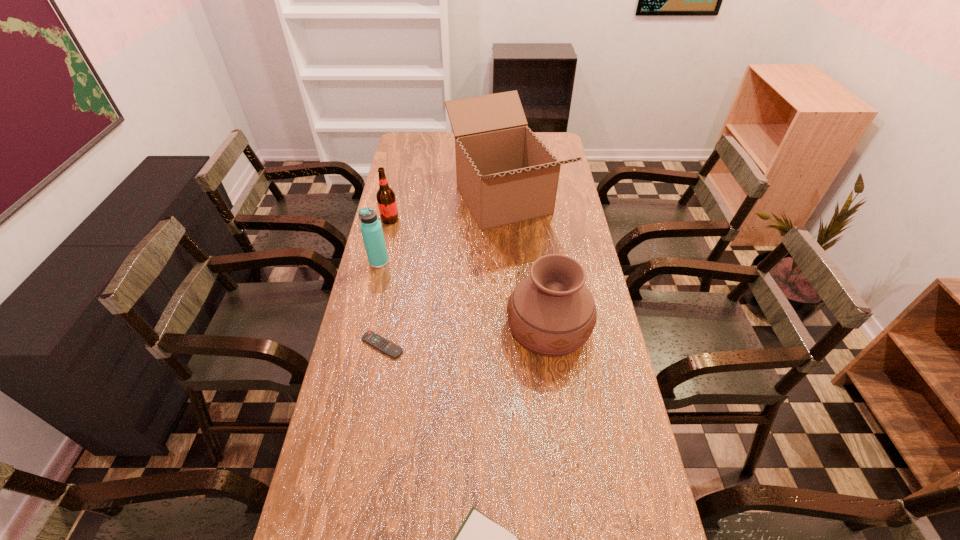
This screenshot has width=960, height=540. I want to click on object that is at the far edge, so click(505, 174).

This screenshot has height=540, width=960. Find the location of `thermos bottle present at the left edge`. thermos bottle present at the left edge is located at coordinates (371, 228).

The height and width of the screenshot is (540, 960). Identify the location of root beer located in the left edge section of the desktop. (386, 200).

The height and width of the screenshot is (540, 960). Identify the location of remote control present at the left edge. 387,347.

Identify the location of box situated at the right edge. (505, 174).

Where is `urn located at the right edge`? urn located at the right edge is located at coordinates (551, 312).

This screenshot has height=540, width=960. In order to click on object at the far right corner in this screenshot , I will do `click(505, 174)`.

Identify the location of vacant space at the left edge. This screenshot has height=540, width=960. (371, 289).

You are a GUI agent. You are given a task and a screenshot of the screen. Output one action in this format:
    pyautogui.click(x=<x>, y=<y>)
    Task: Click on the vacant space at the right edge
    This screenshot has width=960, height=540.
    Given the screenshot: What is the action you would take?
    pyautogui.click(x=649, y=537)

Locate an element on the screen. This screenshot has width=960, height=540. free space between the root beer and the urn is located at coordinates (469, 274).